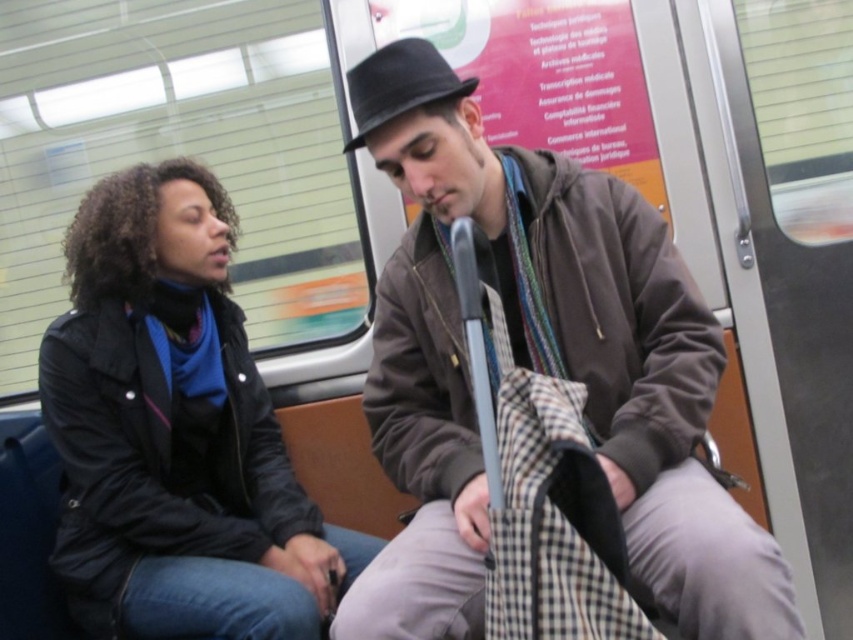
You are a passenger on a train and need to know if the brown textured jacket at center is positioned above or below the black felt fedora at center. Based on the scene description, can you determine their relative positions?

The brown textured jacket at center is located below the black felt fedora at center, so the jacket is positioned below the hat.

You are an interior designer planning to place a large decorative item and a smaller one on a shelf. The brown textured jacket at center and the black felt fedora at center are options. Which object should you choose for the larger space?

The brown textured jacket at center is larger in size than the black felt fedora at center, so it should be placed in the larger space.

You are a passenger on a train and see two items at the center of the scene. Which item is positioned to the right of the other? The items are the brown textured jacket at center and the black felt fedora at center.

The brown textured jacket at center is to the right of the black felt fedora at center.